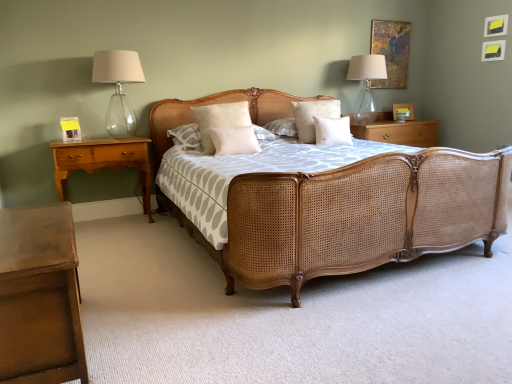
Identify the location of vacant space underneath light brown wood nightstand at left, the 2th nightstand from the back (from a real-world perspective). click(106, 221).